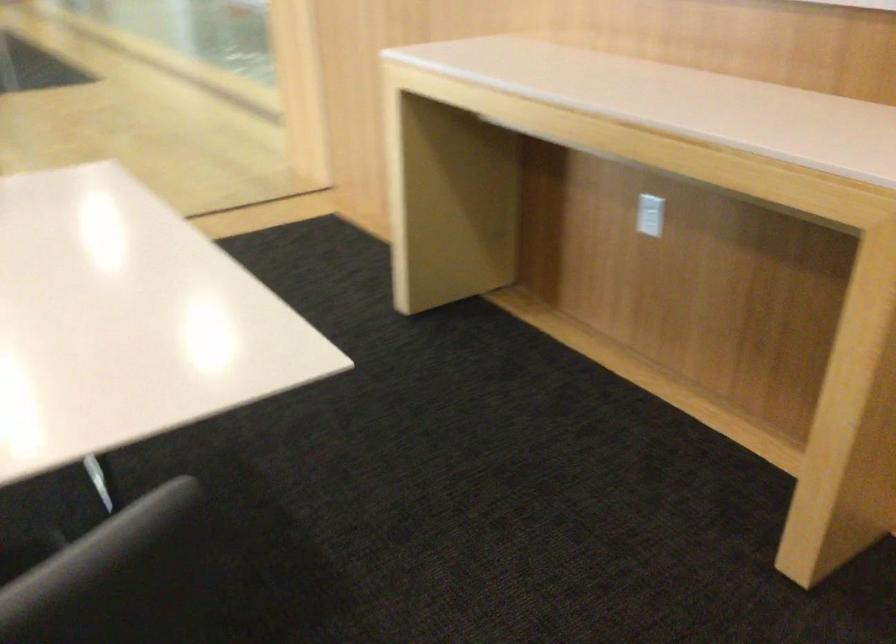
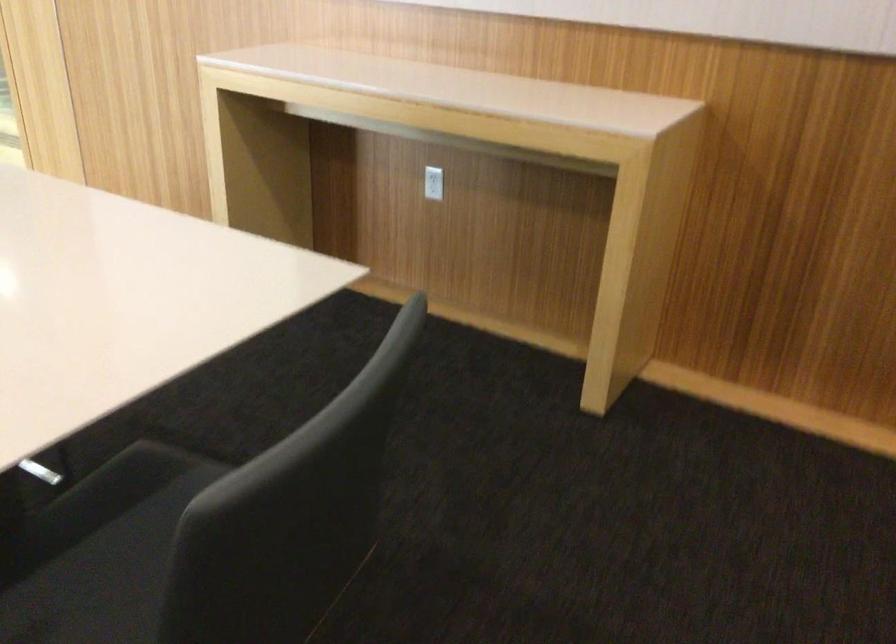
In the second image, find the point that corresponds to point (650, 222) in the first image.

(433, 183)